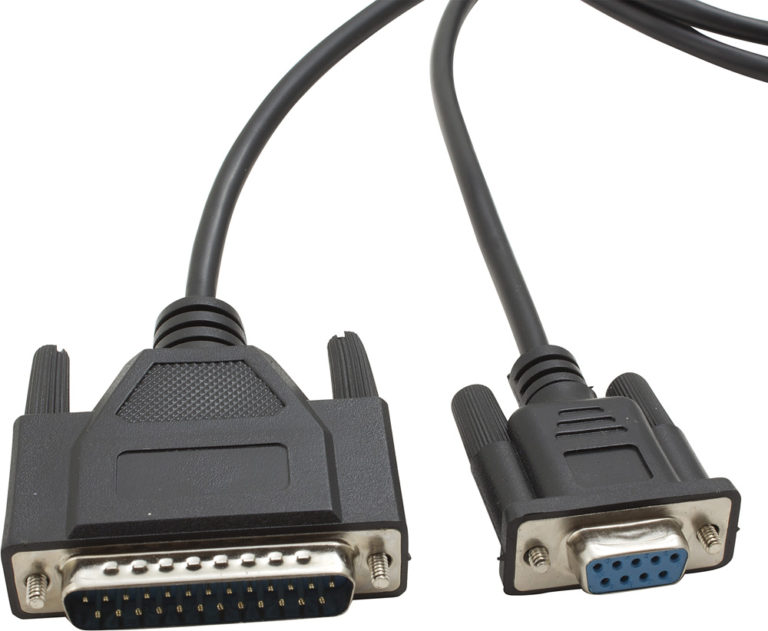
This screenshot has width=768, height=631. I want to click on cord, so click(x=502, y=264).